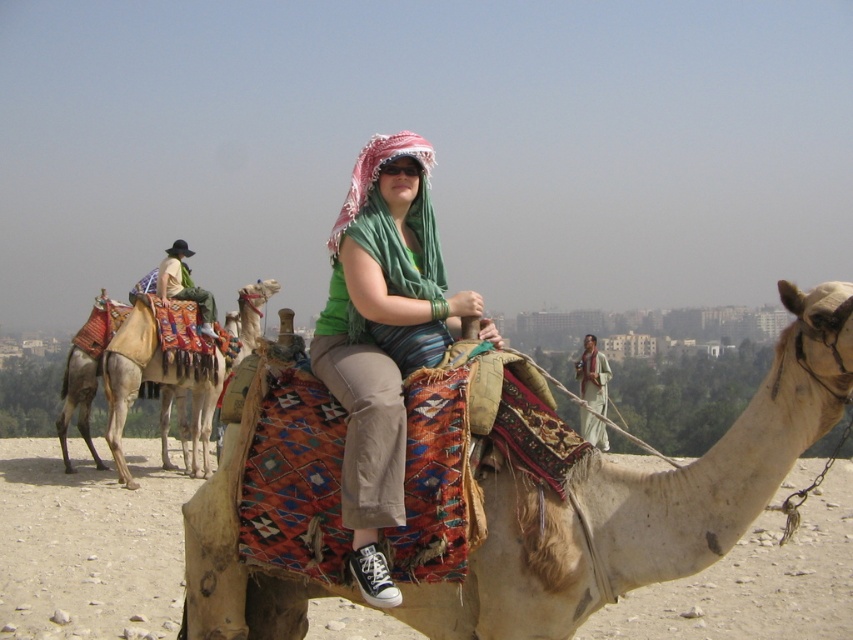
In order to click on beige textured camel at center in this screenshot , I will do `click(643, 500)`.

Based on the photo, is beige textured camel at center wider than beige textured camel at left?

Incorrect, beige textured camel at center's width does not surpass beige textured camel at left's.

Describe the element at coordinates (643, 500) in the screenshot. I see `beige textured camel at center` at that location.

What are the coordinates of `beige textured camel at center` in the screenshot? It's located at (643, 500).

Which is below, green fabric scarf at center or green fabric headscarf at center?

green fabric headscarf at center

In the scene shown: Measure the distance between green fabric scarf at center and camera.

green fabric scarf at center and camera are 5.41 meters apart.

What are the coordinates of `green fabric scarf at center` in the screenshot? It's located at (381, 333).

Can you confirm if green fabric scarf at center is taller than beige textured camel at left?

No, green fabric scarf at center is not taller than beige textured camel at left.

Which is behind, point (373, 148) or point (196, 384)?

The point (196, 384) is behind.

Image resolution: width=853 pixels, height=640 pixels. What are the coordinates of `green fabric scarf at center` in the screenshot? It's located at (381, 333).